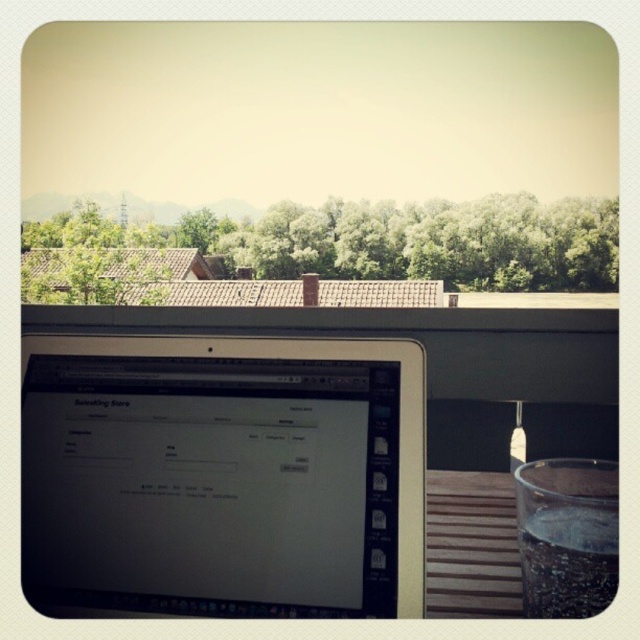
Question: Can you confirm if satin black laptop at center is positioned below clear glass at lower right?

Choices:
 (A) no
 (B) yes

Answer: (A)

Question: Is satin black laptop at center smaller than clear glass at lower right?

Choices:
 (A) yes
 (B) no

Answer: (B)

Question: Does satin black laptop at center have a larger size compared to clear glass at lower right?

Choices:
 (A) no
 (B) yes

Answer: (B)

Question: Which object appears farthest from the camera in this image?

Choices:
 (A) satin black laptop at center
 (B) clear glass at lower right

Answer: (A)

Question: Which of the following is the farthest from the observer?

Choices:
 (A) satin black laptop at center
 (B) clear glass at lower right

Answer: (A)